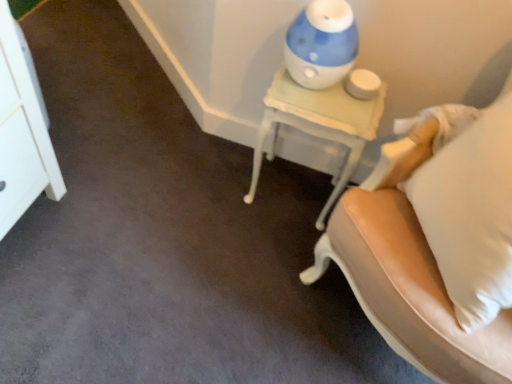
Question: Is blue plastic humidifier at upper right bigger than white leather chair at right?

Choices:
 (A) no
 (B) yes

Answer: (A)

Question: From a real-world perspective, does blue plastic humidifier at upper right sit lower than white leather chair at right?

Choices:
 (A) yes
 (B) no

Answer: (B)

Question: Is white leather chair at right a part of blue plastic humidifier at upper right?

Choices:
 (A) yes
 (B) no

Answer: (B)

Question: Is blue plastic humidifier at upper right next to white leather chair at right and touching it?

Choices:
 (A) yes
 (B) no

Answer: (B)

Question: From the image's perspective, would you say blue plastic humidifier at upper right is shown under white leather chair at right?

Choices:
 (A) no
 (B) yes

Answer: (A)

Question: Is point (304, 97) positioned closer to the camera than point (0, 56)?

Choices:
 (A) farther
 (B) closer

Answer: (A)

Question: From the image's perspective, is white painted wood nightstand at upper right above or below white glossy dresser at upper left?

Choices:
 (A) below
 (B) above

Answer: (A)

Question: Is white painted wood nightstand at upper right wider or thinner than white glossy dresser at upper left?

Choices:
 (A) thin
 (B) wide

Answer: (B)

Question: Would you say white painted wood nightstand at upper right is to the left or to the right of white glossy dresser at upper left in the picture?

Choices:
 (A) left
 (B) right

Answer: (B)

Question: Is point (331, 54) closer or farther from the camera than point (19, 82)?

Choices:
 (A) farther
 (B) closer

Answer: (A)

Question: From a real-world perspective, is blue plastic humidifier at upper right above or below white glossy dresser at upper left?

Choices:
 (A) below
 (B) above

Answer: (B)

Question: In the image, is blue plastic humidifier at upper right positioned in front of or behind white glossy dresser at upper left?

Choices:
 (A) behind
 (B) front

Answer: (B)

Question: Which is correct: blue plastic humidifier at upper right is inside white glossy dresser at upper left, or outside of it?

Choices:
 (A) inside
 (B) outside

Answer: (B)

Question: From a real-world perspective, is blue plastic humidifier at upper right above or below white leather chair at right?

Choices:
 (A) below
 (B) above

Answer: (B)

Question: In terms of height, does blue plastic humidifier at upper right look taller or shorter compared to white leather chair at right?

Choices:
 (A) short
 (B) tall

Answer: (A)